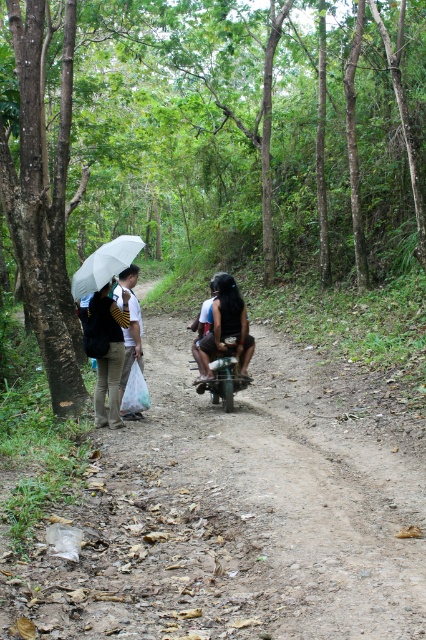
Is dirt road at center positioned in front of white matte umbrella at left?

Yes, it is in front of white matte umbrella at left.

Can you confirm if dirt road at center is shorter than white matte umbrella at left?

Yes, dirt road at center is shorter than white matte umbrella at left.

Locate an element on the screen. This screenshot has width=426, height=640. dirt road at center is located at coordinates (238, 512).

The height and width of the screenshot is (640, 426). In order to click on dirt road at center in this screenshot , I will do tap(238, 512).

Between point (103, 304) and point (101, 273), which one is positioned behind?

The point (103, 304) is behind.

Between matte black backpack at left and white matte umbrella at left, which one appears on the right side from the viewer's perspective?

matte black backpack at left is more to the right.

You are a GUI agent. You are given a task and a screenshot of the screen. Output one action in this format:
    pyautogui.click(x=<x>, y=<y>)
    Task: Click on the matte black backpack at left
    The width and height of the screenshot is (426, 640).
    Given the screenshot: What is the action you would take?
    pyautogui.click(x=106, y=352)

You are a GUI agent. You are given a task and a screenshot of the screen. Output one action in this format:
    pyautogui.click(x=<x>, y=<y>)
    Task: Click on the matte black backpack at left
    The width and height of the screenshot is (426, 640).
    Given the screenshot: What is the action you would take?
    pyautogui.click(x=106, y=352)

Is dirt road at center smaller than matte black backpack at left?

Actually, dirt road at center might be larger than matte black backpack at left.

Is dirt road at center shorter than matte black backpack at left?

Yes.

Which is in front, point (94, 600) or point (109, 408)?

Positioned in front is point (94, 600).

Locate an element on the screen. The height and width of the screenshot is (640, 426). dirt road at center is located at coordinates (238, 512).